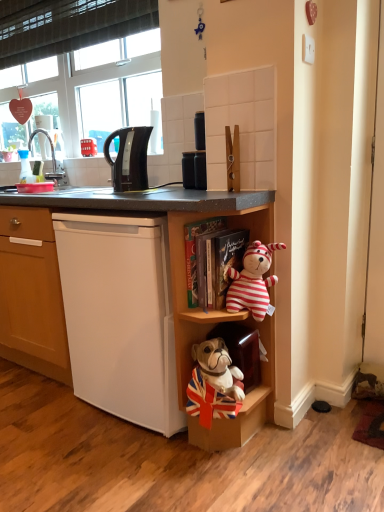
The width and height of the screenshot is (384, 512). Find the location of `space that is in front of wooden shelf at lower right, marked as the first shelf in a bottom-to-top arrangement`. space that is in front of wooden shelf at lower right, marked as the first shelf in a bottom-to-top arrangement is located at coordinates (236, 483).